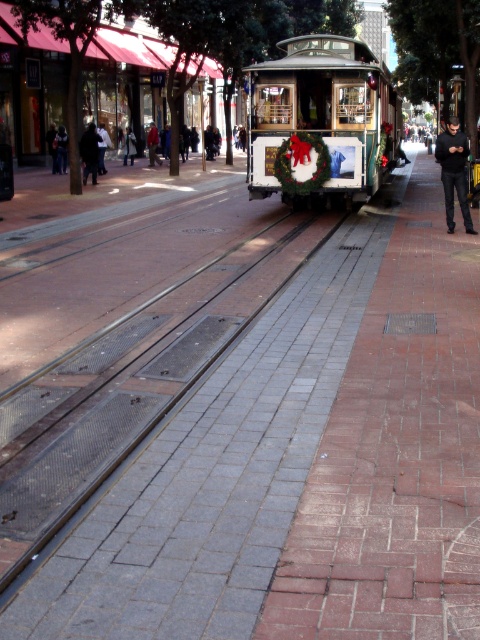
You are a delivery person trying to deliver a package to the light brown leather jacket at center. The package is too large to carry while riding the white wooden cable car at center. If you place the package on the ground next to the cable car, will it fit between them without overlapping?

The white wooden cable car at center is wider than the light brown leather jacket at center. Since the package is too large to carry while riding, placing it on the ground next to the cable car may not leave enough space between them, as the cable car is wider. You should check the exact dimensions to ensure there is sufficient space.

You are standing on the sidewalk next to the cable car tracks and see two people wearing jackets. One has a black fabric jacket at center and the other has a red jacket at center. Which jacket is closer to you?

The black fabric jacket at center is closer to the viewer than the red jacket at center.

Consider the image. You are standing at the position of the red jacket at center and want to walk to the black fabric jacket at center. Given that the distance between them is 10.38 meters, how many steps would you need to take if each step covers approximately 0.75 meters?

To determine the number of steps needed to walk from the red jacket at center to the black fabric jacket at center, divide the total distance of 10.38 meters by the step length of 0.75 meters. This results in approximately 13.84 steps. Since you can only take whole steps, you would need to take 14 steps to cover the distance between the red jacket at center and the black fabric jacket at center.